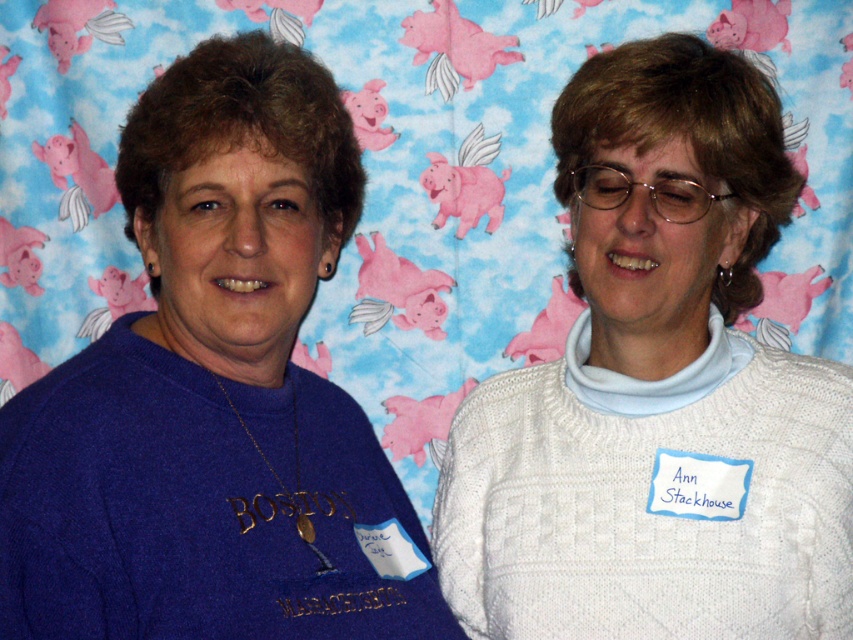
You are a fashion designer observing two sweaters in the image. The white knitted sweater at center and the matte blue sweater at left. Which one is taller?

The white knitted sweater at center is taller than the matte blue sweater at left.

You are a photographer setting up a photo shoot. You need to ensure that both the white knitted sweater at center and the matte blue sweater at left are visible in the frame. Based on their positions, which sweater might partially block the other?

The matte blue sweater at left is behind the white knitted sweater at center, so it might be partially blocked by the white knitted sweater at center.

You are an assistant organizing a clothing store. You need to arrange the white knitted sweater at center and the matte blue sweater at left on a mannequin. According to the spatial arrangement in the image, which sweater should be placed on top?

The matte blue sweater at left should be placed on top because the white knitted sweater at center is below it in the image.